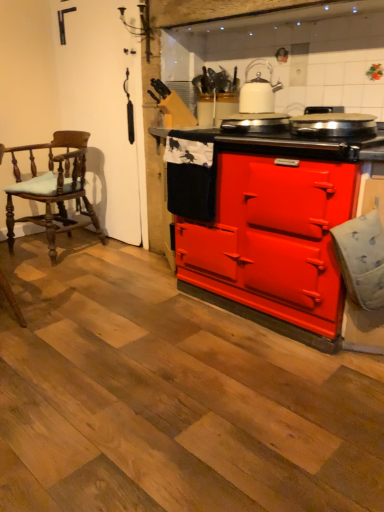
Question: From the image's perspective, is red matte stove at center, placed as the 1th appliance when sorted from left to right, located above or below shiny metallic pan at center, the 1th appliance from the right?

Choices:
 (A) below
 (B) above

Answer: (B)

Question: Is point (240, 120) closer or farther from the camera than point (317, 120)?

Choices:
 (A) farther
 (B) closer

Answer: (A)

Question: Which object is positioned closest to the white glossy kettle at upper center?

Choices:
 (A) matte red stove at center
 (B) wooden polished chair at left
 (C) red matte stove at center, marked as the second appliance in a right-to-left arrangement
 (D) shiny metallic pan at center, the second appliance in the left-to-right sequence

Answer: (C)

Question: Based on their relative distances, which object is nearer to the red matte stove at center, placed as the 1th appliance when sorted from left to right?

Choices:
 (A) white glossy kettle at upper center
 (B) wooden polished chair at left
 (C) matte red stove at center
 (D) shiny metallic pan at center, the 1th appliance from the right

Answer: (A)